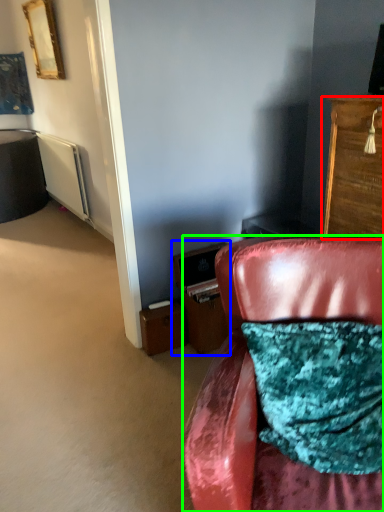
Question: Which is nearer to the cabinetry (highlighted by a red box)? file cabinet (highlighted by a blue box) or chair (highlighted by a green box).

Choices:
 (A) file cabinet
 (B) chair

Answer: (B)